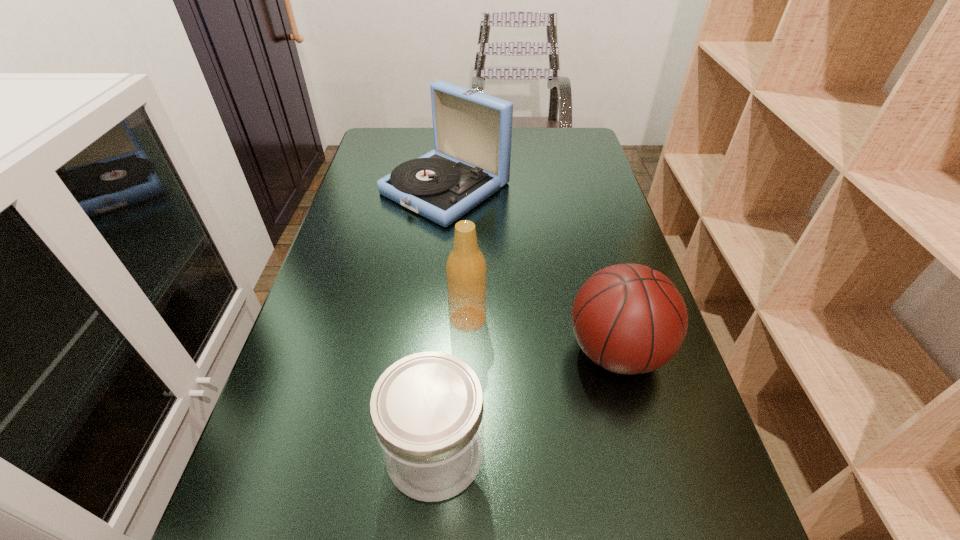
Where is `object present at the far edge`? This screenshot has width=960, height=540. object present at the far edge is located at coordinates (472, 131).

Identify the location of object that is at the left edge. (472, 131).

You are a GUI agent. You are given a task and a screenshot of the screen. Output one action in this format:
    pyautogui.click(x=<x>, y=<y>)
    Task: Click on the object that is at the right edge
    Image resolution: width=960 pixels, height=540 pixels.
    Given the screenshot: What is the action you would take?
    pyautogui.click(x=630, y=319)

This screenshot has height=540, width=960. In order to click on object that is at the far left corner in this screenshot , I will do `click(472, 131)`.

Where is `vacant space at the far edge of the desktop`? The width and height of the screenshot is (960, 540). vacant space at the far edge of the desktop is located at coordinates (533, 160).

This screenshot has height=540, width=960. In the image, there is a desktop. Identify the location of free space at the left edge. (321, 386).

Image resolution: width=960 pixels, height=540 pixels. I want to click on vacant region at the right edge of the desktop, so click(604, 218).

In the image, there is a desktop. Identify the location of vacant region at the far left corner. The height and width of the screenshot is (540, 960). (400, 132).

Identify the location of vacant space at the far right corner. Image resolution: width=960 pixels, height=540 pixels. (549, 154).

Find the location of a particular element. free point between the phonograph record and the nearest object is located at coordinates (441, 320).